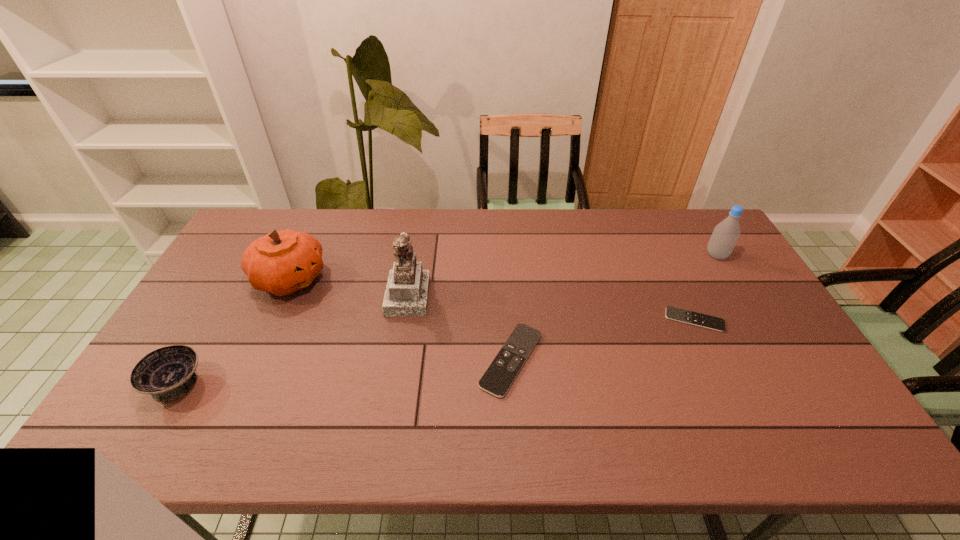
At what (x,y) coordinates should I click in order to perform the action: click on remote control located in the right edge section of the desktop. Please return your answer as a coordinate pair (x, y). The width and height of the screenshot is (960, 540). Looking at the image, I should click on (681, 315).

The width and height of the screenshot is (960, 540). Identify the location of bottle located at the right edge. (725, 235).

The width and height of the screenshot is (960, 540). In order to click on object present at the near left corner in this screenshot , I will do `click(167, 373)`.

Where is `object that is at the far right corner`? This screenshot has width=960, height=540. object that is at the far right corner is located at coordinates (725, 235).

Find the location of a particular element. vacant space at the far edge of the desktop is located at coordinates (618, 249).

The height and width of the screenshot is (540, 960). Identify the location of vacant point at the near edge. (656, 409).

Locate an element on the screen. The width and height of the screenshot is (960, 540). free space at the right edge is located at coordinates (706, 255).

Where is `free region at the far left corner of the desktop`? This screenshot has height=540, width=960. free region at the far left corner of the desktop is located at coordinates (250, 219).

Find the location of `vacant region at the near right corner of the desktop`. vacant region at the near right corner of the desktop is located at coordinates 812,392.

I want to click on free space between the left remote control and the pumpkin, so click(x=400, y=319).